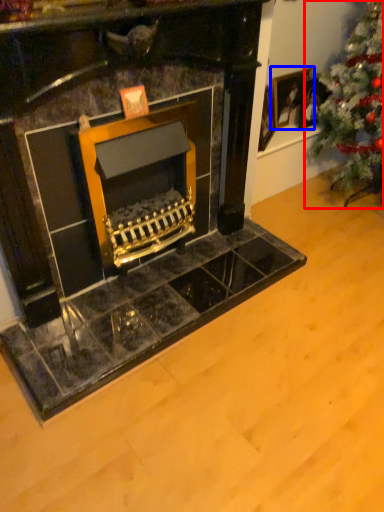
Question: Among these objects, which one is nearest to the camera, christmas tree (highlighted by a red box) or picture frame (highlighted by a blue box)?

Choices:
 (A) christmas tree
 (B) picture frame

Answer: (A)